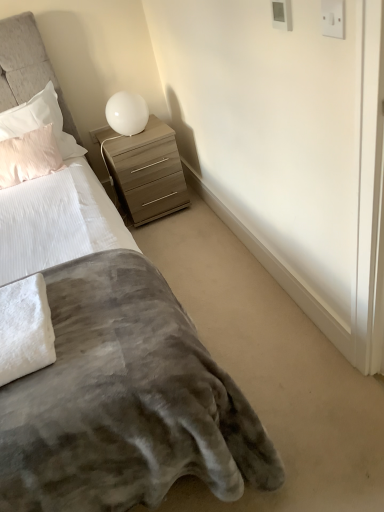
Question: Considering the positions of white plastic electric outlet at upper right, the second electric outlet positioned from the left, and white fluffy towel at lower left in the image, is white plastic electric outlet at upper right, the second electric outlet positioned from the left, bigger or smaller than white fluffy towel at lower left?

Choices:
 (A) small
 (B) big

Answer: (A)

Question: Considering their positions, is white plastic electric outlet at upper right, placed as the second electric outlet when sorted from top to bottom, located in front of or behind white fluffy towel at lower left?

Choices:
 (A) front
 (B) behind

Answer: (A)

Question: Estimate the real-world distances between objects in this image. Which object is farther from the matte wood chest of drawers at upper right?

Choices:
 (A) pale pink plush pillow at upper left, which appears as the second pillow when viewed from the top
 (B) velvet gray blanket at lower left
 (C) white glossy table lamp at upper right
 (D) white fluffy towel at lower left
 (E) white plastic electric outlet at upper right, which is the first electric outlet in bottom-to-top order

Answer: (E)

Question: Which is nearer to the white fluffy towel at lower left?

Choices:
 (A) matte wood chest of drawers at upper right
 (B) white plastic electric outlet at upper right, the second electric outlet positioned from the front
 (C) white plastic electric outlet at upper right, positioned as the first electric outlet in front-to-back order
 (D) pink satin pillow at upper left, which is counted as the second pillow, starting from the bottom
 (E) white glossy table lamp at upper right

Answer: (C)